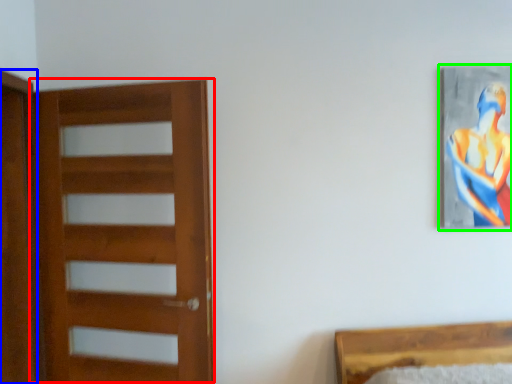
Question: Based on their relative distances, which object is farther from door (highlighted by a red box)? Choose from screen door (highlighted by a blue box) and picture frame (highlighted by a green box).

Choices:
 (A) screen door
 (B) picture frame

Answer: (B)